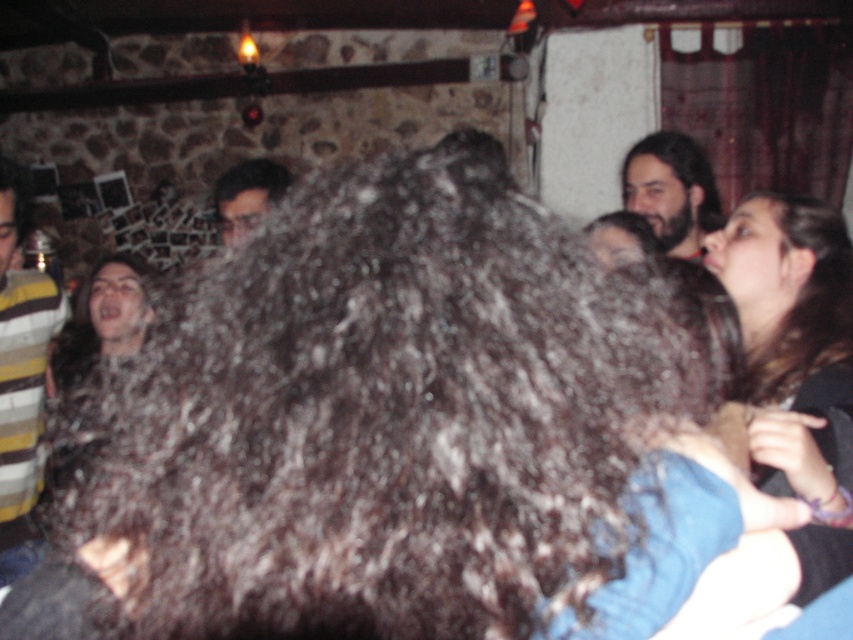
You are standing in the bar and want to reach the striped wool sweater at left without moving any people. Is it possible?

The striped wool sweater at left is 5.81 feet from viewer, so yes, it is possible to reach it without moving any people as it is within a reachable distance.

Based on the photo, you are a photographer trying to capture a detailed shot of the striped wool sweater at left and the dark brown hair at upper right. Which object would require a wider angle to fit entirely in the frame?

The dark brown hair at upper right requires a wider angle because it has a greater width than the striped wool sweater at left.

Consider the image. You are a photographer trying to capture a closeup shot of the dark brown hair at upper right and the matte black hair at center. Which hair style would require a wider angle lens to fit entirely in the frame?

The dark brown hair at upper right requires a wider angle lens because its width is larger than the matte black hair at center.